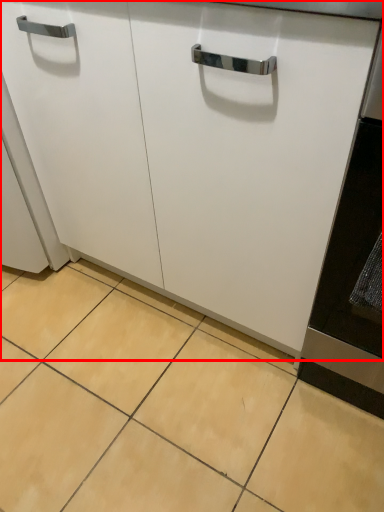
Question: Where is cabinetry (annotated by the red box) located in relation to ceramic tile in the image?

Choices:
 (A) right
 (B) left

Answer: (A)